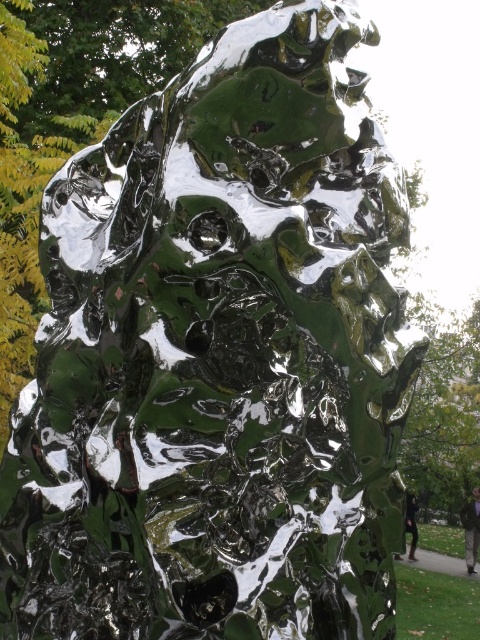
You are an art curator planning to display the glossy green sculpture at center and the dark green glossy statue at right in a gallery. If the gallery has a 1.5 meter wide space allocated for both, will they fit side by side?

The glossy green sculpture at center is wider than the dark green glossy statue at right. However, without specific measurements of each object, it is impossible to determine if their combined width will fit within the 1.5 meter space. Additional information about their individual dimensions is required to make an accurate assessment.

You are standing in front of the sculpture and see two points marked on the sculpture. The first point is at coordinates point (470, 552) and the second point is at point (408, 520). Which point is closer to you?

Point (408, 520) is closer to you because it is in front of point (470, 552).